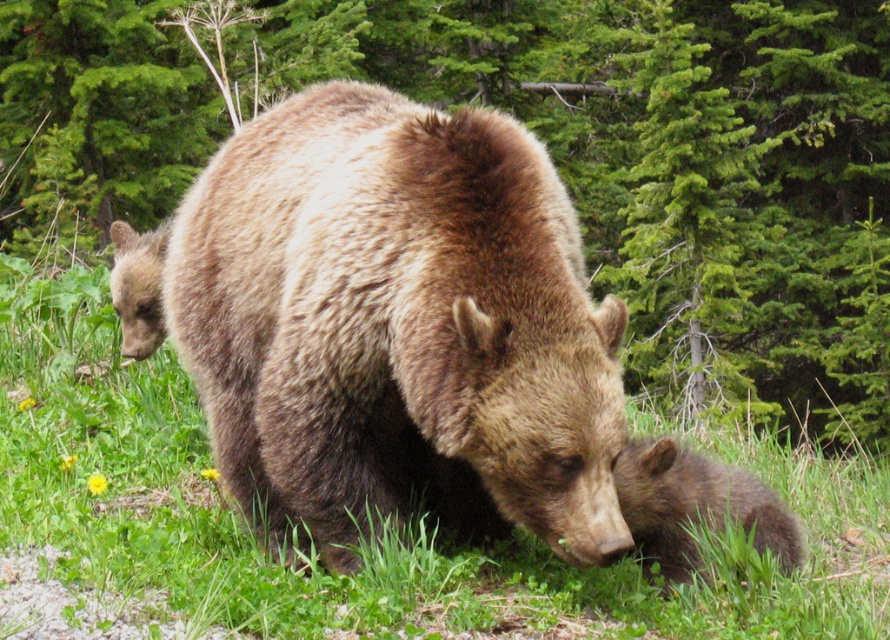
You are a hiker who wants to take a photo of the brown furry bear at center without blocking the green leafy tree at upper center. Which side should you stand relative to the bear to ensure the tree is visible in the background?

The green leafy tree at upper center is positioned on the right side of brown furry bear at center, so you should stand to the left side of the bear to ensure the tree remains visible in the background.

You are a hiker trying to take a photo of the brown furry bear at center without getting too close. You notice a green leafy tree at upper center in the background. Which object would appear bigger in your camera viewfinder?

The green leafy tree at upper center appears larger in the camera viewfinder because it is larger in size than the brown furry bear at center.